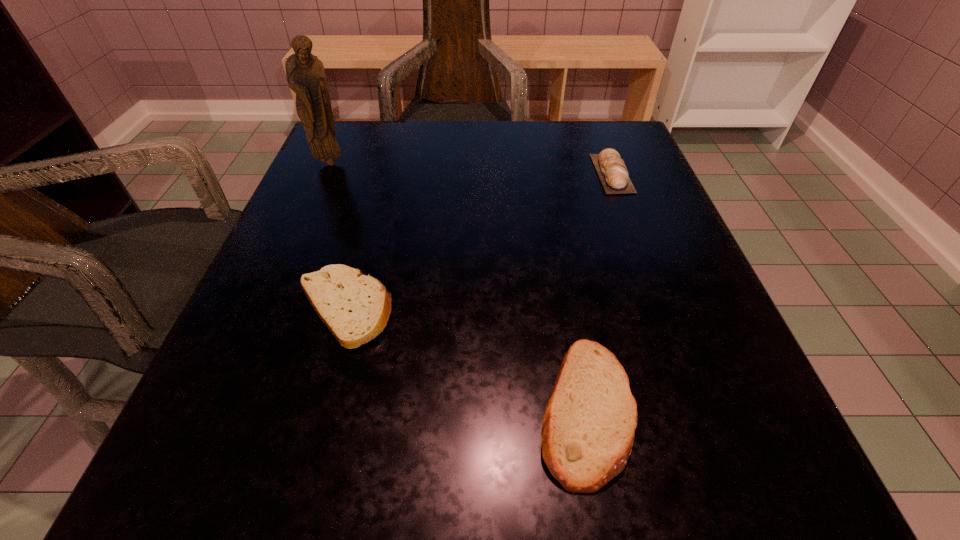
Where is `free space located on the back of the leftmost pita bread`? free space located on the back of the leftmost pita bread is located at coordinates (389, 147).

Identify the location of figurine that is at the far edge. The image size is (960, 540). (305, 73).

You are a GUI agent. You are given a task and a screenshot of the screen. Output one action in this format:
    pyautogui.click(x=<x>, y=<y>)
    Task: Click on the pita bread located at the far edge
    
    Given the screenshot: What is the action you would take?
    pyautogui.click(x=611, y=169)

Identify the location of object positioned at the near edge. (589, 424).

Identify the location of figurine present at the left edge. (305, 73).

Find the location of a particular element. This screenshot has height=540, width=960. pita bread at the left edge is located at coordinates (356, 308).

Where is `object present at the far left corner`? object present at the far left corner is located at coordinates (305, 73).

Where is `object that is at the far right corner`? object that is at the far right corner is located at coordinates (611, 169).

Where is `object positioned at the near right corner`? The height and width of the screenshot is (540, 960). object positioned at the near right corner is located at coordinates (589, 424).

Find the location of `vacant space at the far edge of the desktop`. vacant space at the far edge of the desktop is located at coordinates (456, 153).